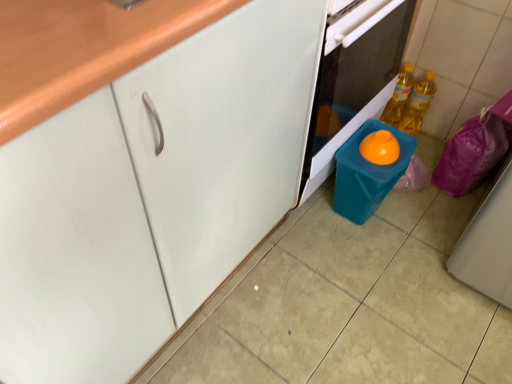
Where is `yellow translucent bottle at right, acting as the first bottle starting from the left`? yellow translucent bottle at right, acting as the first bottle starting from the left is located at coordinates (398, 96).

You are a GUI agent. You are given a task and a screenshot of the screen. Output one action in this format:
    pyautogui.click(x=<x>, y=<y>)
    Task: Click on the blue plastic bin at lower center
    This screenshot has height=384, width=512.
    Given the screenshot: What is the action you would take?
    pyautogui.click(x=353, y=78)

The height and width of the screenshot is (384, 512). What do you see at coordinates (367, 173) in the screenshot?
I see `teal plastic container at lower right` at bounding box center [367, 173].

The width and height of the screenshot is (512, 384). Identify the location of yellow translucent bottle at right, positioned as the second bottle in right-to-left order. (398, 96).

Is blue plastic bin at lower center facing towards yellow translucent bottle at right, acting as the first bottle starting from the left?

No, blue plastic bin at lower center is not facing towards yellow translucent bottle at right, acting as the first bottle starting from the left.

Considering the positions of point (344, 28) and point (407, 97), is point (344, 28) closer or farther from the camera than point (407, 97)?

Point (344, 28).

Considering the relative positions of blue plastic bin at lower center and yellow translucent bottle at right, positioned as the second bottle in right-to-left order, in the image provided, is blue plastic bin at lower center to the left or to the right of yellow translucent bottle at right, positioned as the second bottle in right-to-left order,?

blue plastic bin at lower center is positioned on yellow translucent bottle at right, positioned as the second bottle in right-to-left order,'s left side.

Between blue plastic bin at lower center and yellow translucent bottle at right, positioned as the second bottle in right-to-left order, which one has smaller size?

yellow translucent bottle at right, positioned as the second bottle in right-to-left order, is smaller.

Locate an element on the screen. bottle that is in front of the yellow translucent bottle at right, positioned as the second bottle in right-to-left order is located at coordinates (417, 104).

Measure the distance from yellow translucent bottle at right, acting as the first bottle starting from the left, to translucent yellow bottle at right, arranged as the 1th bottle when viewed from the right.

yellow translucent bottle at right, acting as the first bottle starting from the left, and translucent yellow bottle at right, arranged as the 1th bottle when viewed from the right, are 1.86 inches apart.

In terms of size, does yellow translucent bottle at right, acting as the first bottle starting from the left, appear bigger or smaller than translucent yellow bottle at right, marked as the second bottle in a left-to-right arrangement?

In the image, yellow translucent bottle at right, acting as the first bottle starting from the left, appears to be larger than translucent yellow bottle at right, marked as the second bottle in a left-to-right arrangement.

Looking at this image, is yellow translucent bottle at right, positioned as the second bottle in right-to-left order, in contact with translucent yellow bottle at right, arranged as the 1th bottle when viewed from the right?

Yes, yellow translucent bottle at right, positioned as the second bottle in right-to-left order, is in contact with translucent yellow bottle at right, arranged as the 1th bottle when viewed from the right.

Would you say teal plastic container at lower right is outside translucent yellow bottle at right, arranged as the 1th bottle when viewed from the right?

That's correct, teal plastic container at lower right is outside of translucent yellow bottle at right, arranged as the 1th bottle when viewed from the right.

Does teal plastic container at lower right come in front of translucent yellow bottle at right, marked as the second bottle in a left-to-right arrangement?

That is True.

Does point (337, 164) lie behind point (417, 95)?

No, it is in front of (417, 95).

Between teal plastic container at lower right and translucent yellow bottle at right, marked as the second bottle in a left-to-right arrangement, which one has larger size?

teal plastic container at lower right is bigger.

Identify the location of cabinetry in front of the blue plastic bin at lower center. (139, 168).

Which is correct: blue plastic bin at lower center is inside white matte cabinet at center, or outside of it?

The correct answer is: outside.

Does point (298, 201) lie in front of point (147, 115)?

No.

Can you confirm if white matte cabinet at center is taller than blue plastic bin at lower center?

Yes.

Considering the relative sizes of white matte cabinet at center and blue plastic bin at lower center in the image provided, is white matte cabinet at center thinner than blue plastic bin at lower center?

Incorrect, the width of white matte cabinet at center is not less than that of blue plastic bin at lower center.

Which is more to the left, white matte cabinet at center or blue plastic bin at lower center?

From the viewer's perspective, white matte cabinet at center appears more on the left side.

Can you tell me how much white matte cabinet at center and teal plastic container at lower right differ in facing direction?

They differ by 0.331 degrees in their facing directions.

Is white matte cabinet at center inside the boundaries of teal plastic container at lower right, or outside?

white matte cabinet at center lies outside teal plastic container at lower right.

Which point is more forward, (315, 69) or (365, 124)?

Positioned in front is point (315, 69).

From a real-world perspective, is white matte cabinet at center above or below teal plastic container at lower right?

From a real-world perspective, white matte cabinet at center is physically above teal plastic container at lower right.

Which of these two, yellow translucent bottle at right, positioned as the second bottle in right-to-left order, or blue plastic bin at lower center, is bigger?

With larger size is blue plastic bin at lower center.

Looking at this image, considering the sizes of objects yellow translucent bottle at right, positioned as the second bottle in right-to-left order, and blue plastic bin at lower center in the image provided, who is taller, yellow translucent bottle at right, positioned as the second bottle in right-to-left order, or blue plastic bin at lower center?

blue plastic bin at lower center is taller.

Is yellow translucent bottle at right, acting as the first bottle starting from the left, turned away from blue plastic bin at lower center?

yellow translucent bottle at right, acting as the first bottle starting from the left, is not turned away from blue plastic bin at lower center.

From a real-world perspective, is yellow translucent bottle at right, positioned as the second bottle in right-to-left order, located beneath blue plastic bin at lower center?

Yes, from a real-world perspective, yellow translucent bottle at right, positioned as the second bottle in right-to-left order, is below blue plastic bin at lower center.

You are a GUI agent. You are given a task and a screenshot of the screen. Output one action in this format:
    pyautogui.click(x=<x>, y=<y>)
    Task: Click on the 2nd bottle located beneath the blue plastic bin at lower center (from a real-world perspective)
    
    Given the screenshot: What is the action you would take?
    pyautogui.click(x=398, y=96)

Find the location of a particular element. Image resolution: width=512 pixels, height=384 pixels. bottle that appears below the yellow translucent bottle at right, acting as the first bottle starting from the left (from the image's perspective) is located at coordinates (417, 104).

When comparing their distances from translucent yellow bottle at right, arranged as the 1th bottle when viewed from the right, does yellow translucent bottle at right, acting as the first bottle starting from the left, or blue plastic bin at lower center seem closer?

yellow translucent bottle at right, acting as the first bottle starting from the left.

From the image, which object appears to be farther from blue plastic bin at lower center, white matte cabinet at center or teal plastic container at lower right?

The object further to blue plastic bin at lower center is white matte cabinet at center.

From the image, which object appears to be nearer to teal plastic container at lower right, translucent yellow bottle at right, marked as the second bottle in a left-to-right arrangement, or blue plastic bin at lower center?

Among the two, blue plastic bin at lower center is located nearer to teal plastic container at lower right.

Which object lies nearer to the anchor point white matte cabinet at center, translucent yellow bottle at right, marked as the second bottle in a left-to-right arrangement, or blue plastic bin at lower center?

blue plastic bin at lower center is closer to white matte cabinet at center.

Looking at the image, which one is located closer to yellow translucent bottle at right, acting as the first bottle starting from the left, translucent yellow bottle at right, marked as the second bottle in a left-to-right arrangement, or white matte cabinet at center?

Based on the image, translucent yellow bottle at right, marked as the second bottle in a left-to-right arrangement, appears to be nearer to yellow translucent bottle at right, acting as the first bottle starting from the left.

From the image, which object appears to be nearer to white matte cabinet at center, yellow translucent bottle at right, positioned as the second bottle in right-to-left order, or teal plastic container at lower right?

teal plastic container at lower right is positioned closer to the anchor white matte cabinet at center.

Looking at the image, which one is located closer to blue plastic bin at lower center, white matte cabinet at center or yellow translucent bottle at right, acting as the first bottle starting from the left?

The object closer to blue plastic bin at lower center is white matte cabinet at center.

Estimate the real-world distances between objects in this image. Which object is closer to yellow translucent bottle at right, acting as the first bottle starting from the left, blue plastic bin at lower center or translucent yellow bottle at right, marked as the second bottle in a left-to-right arrangement?

translucent yellow bottle at right, marked as the second bottle in a left-to-right arrangement, is positioned closer to the anchor yellow translucent bottle at right, acting as the first bottle starting from the left.

The width and height of the screenshot is (512, 384). Identify the location of appliance located between blue plastic bin at lower center and yellow translucent bottle at right, acting as the first bottle starting from the left, in the depth direction. (367, 173).

At what (x,y) coordinates should I click in order to perform the action: click on bottle positioned between blue plastic bin at lower center and yellow translucent bottle at right, acting as the first bottle starting from the left, from near to far. Please return your answer as a coordinate pair (x, y). The image size is (512, 384). Looking at the image, I should click on (417, 104).

The image size is (512, 384). What are the coordinates of `home appliance between white matte cabinet at center and teal plastic container at lower right along the z-axis` in the screenshot? It's located at (353, 78).

What are the coordinates of `appliance between white matte cabinet at center and translucent yellow bottle at right, marked as the second bottle in a left-to-right arrangement, along the z-axis` in the screenshot? It's located at (367, 173).